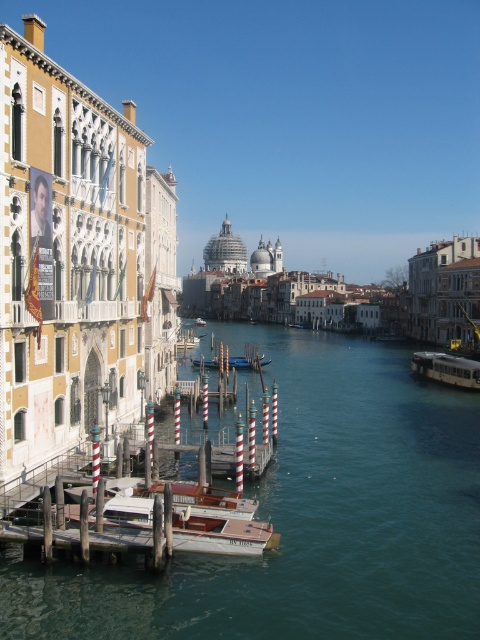
You are a tourist standing on the dock and want to take a photo of both the wooden polished boat at center and the wooden gondola at center. Since you can only focus on one boat at a time, which boat should you focus on to ensure the other is still visible in the background?

You should focus on the wooden polished boat at center because it is in front of the wooden gondola at center, so the gondola will appear in the background when you focus on the boat in front.

You are standing at the point marked by coordinates point (212, 500) in the image. What object are you directly at?

You are directly at the wooden polished boat at center.